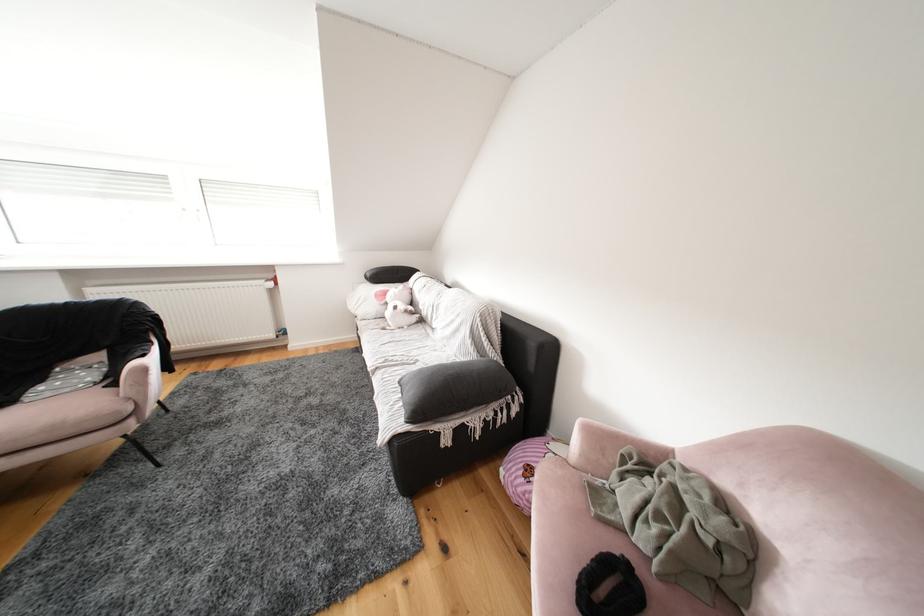
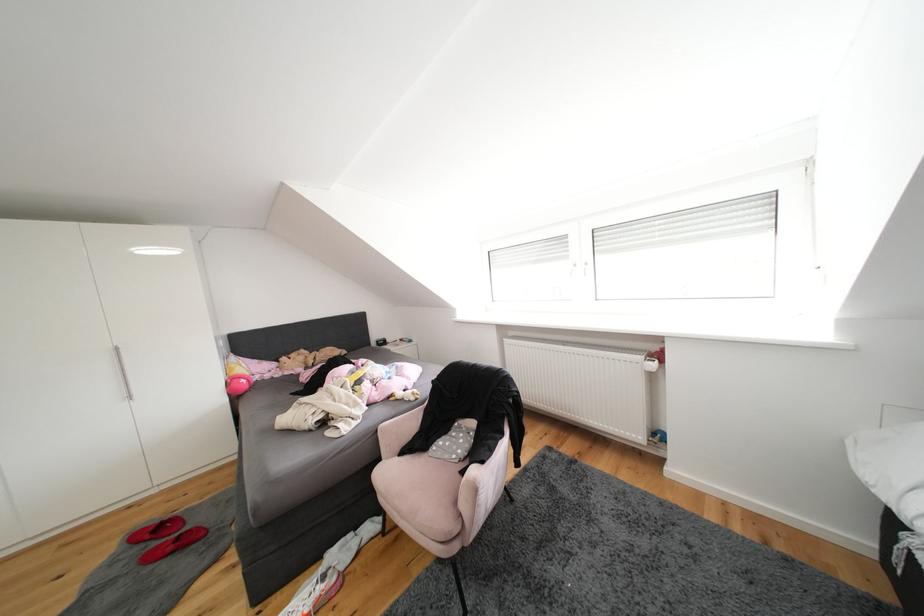
Find the pixel in the second image that matches (x=359, y=312) in the first image.

(874, 479)